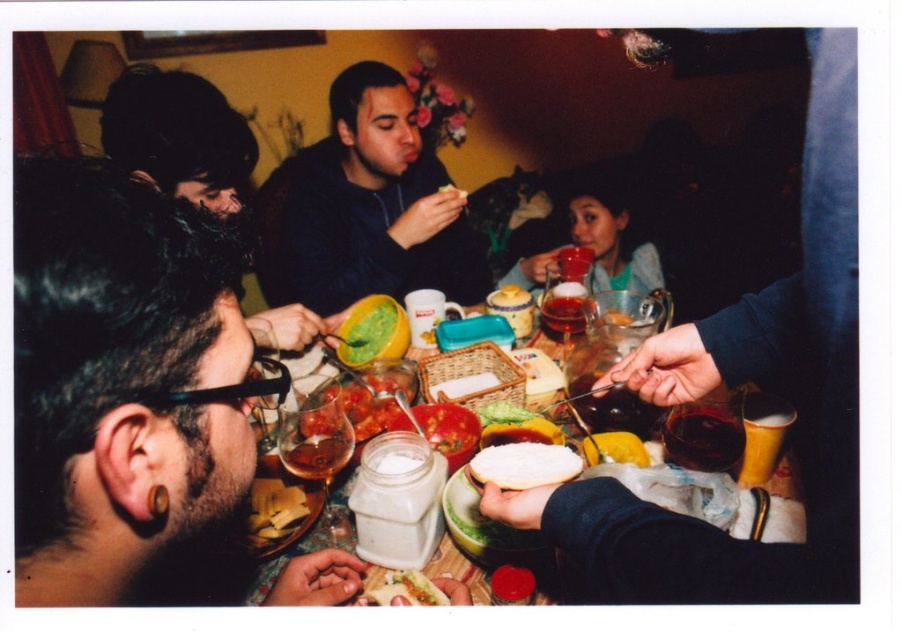
You are a guest at this gathering and want to reach for the smooth white bread at center without disturbing the dark brown hair at center. Which item should you move first?

You should move the dark brown hair at center first because it is closer to you than the smooth white bread at center, so you can adjust it out of the way before accessing the bread.

You are at a dinner party and want to grab a drink. You see a dark red glass at center and a translucent glass cup at center. Which one is on the right side?

The dark red glass at center is to the right of the translucent glass cup at center, so the dark red glass at center is on the right side.